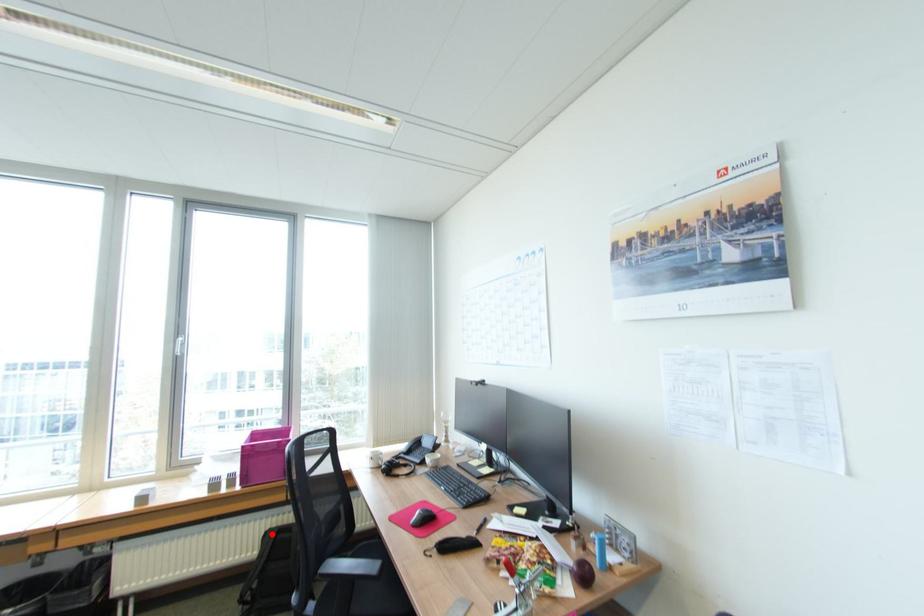
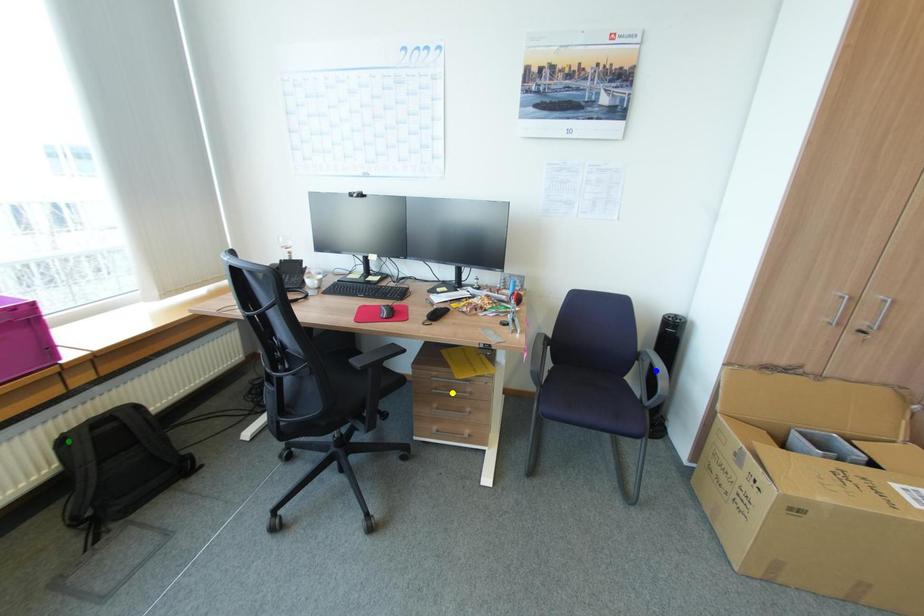
Question: I am providing you with two images of the same scene from different viewpoints. A red point is marked on the first image. You are given multiple points on the second image. Which mark in image 2 goes with the point in image 1?

Choices:
 (A) green point
 (B) blue point
 (C) yellow point

Answer: (A)